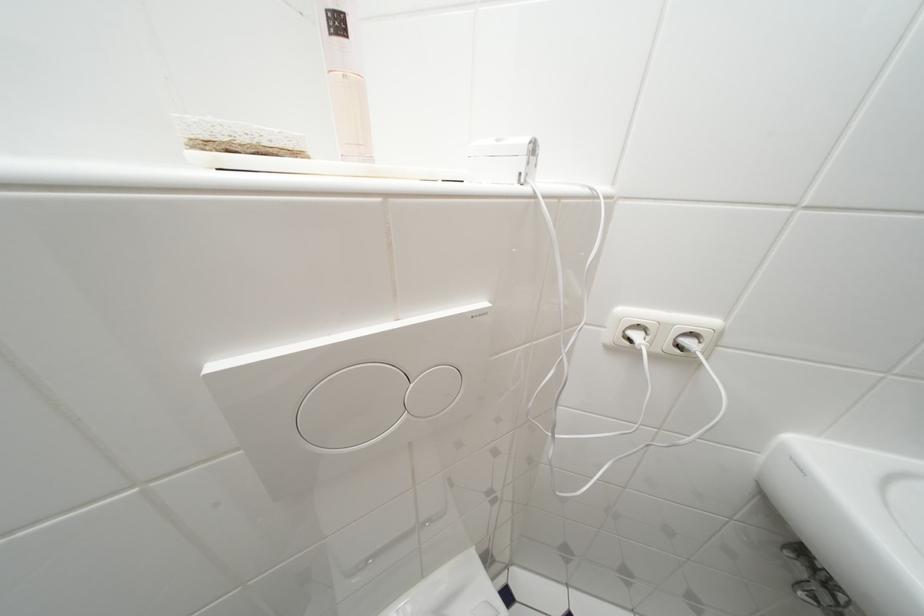
Find where to lift the pink glass bottle. Please return your answer as a coordinate pair (x, y).

(345, 79)